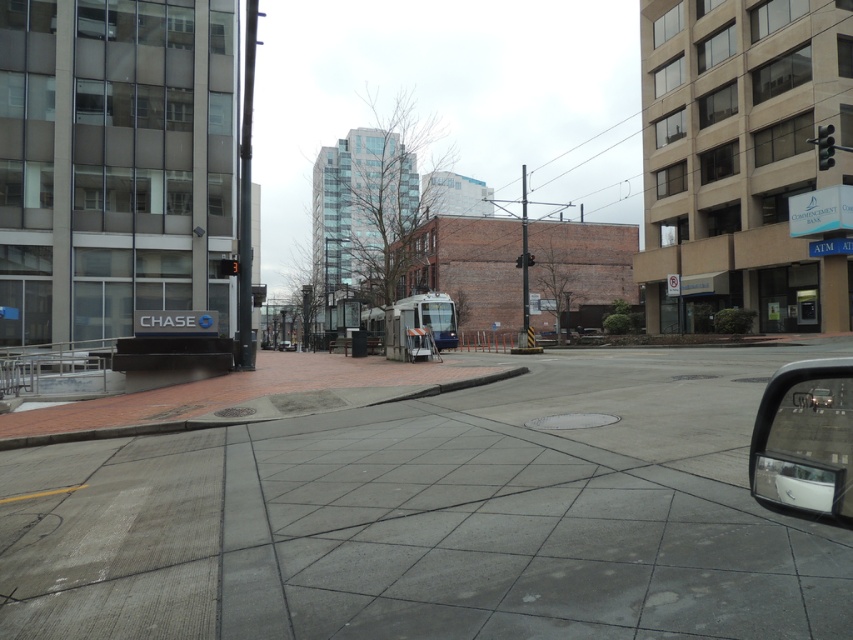
Does metallic gray car at lower right have a larger size compared to matte black car at center?

No.

Which is behind, point (816, 404) or point (277, 342)?

Point (277, 342)

Does point (824, 403) lie behind point (280, 346)?

No, (824, 403) is in front of (280, 346).

I want to click on metallic gray car at lower right, so click(x=820, y=397).

Measure the distance between point (851, 404) and camera.

A distance of 7.51 feet exists between point (851, 404) and camera.

Who is shorter, white glossy car at right or red glass traffic light at center?

Standing shorter between the two is white glossy car at right.

Is point (828, 460) farther from camera compared to point (532, 256)?

No, it is not.

Where is `white glossy car at right`? This screenshot has width=853, height=640. white glossy car at right is located at coordinates (804, 438).

Between concrete sidewalk at center and yellow matte traffic light at upper center, which one is positioned higher?

yellow matte traffic light at upper center is above.

Does point (720, 461) come in front of point (219, 260)?

Yes, point (720, 461) is closer to viewer.

The width and height of the screenshot is (853, 640). I want to click on concrete sidewalk at center, so click(x=434, y=516).